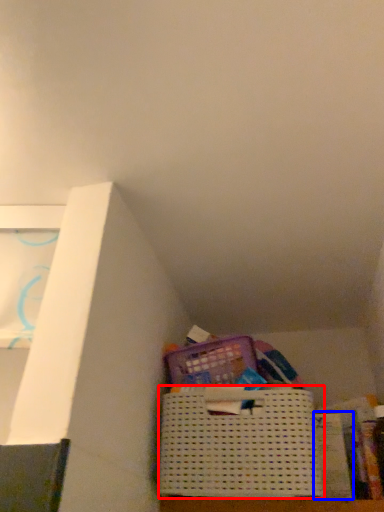
Question: Which point is closer to the camera, basket (highlighted by a red box) or paperback book (highlighted by a blue box)?

Choices:
 (A) basket
 (B) paperback book

Answer: (A)